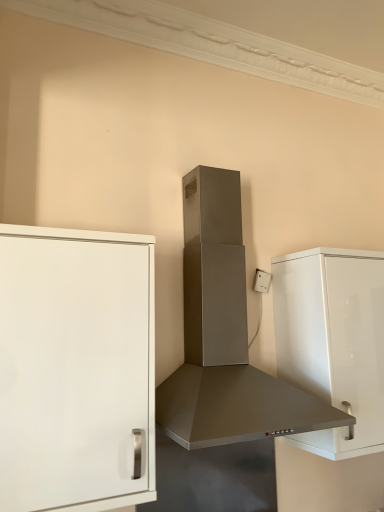
Measure the distance between satin silver range hood at center and camera.

satin silver range hood at center and camera are 1.16 meters apart.

Locate an element on the screen. This screenshot has height=512, width=384. white plastic electric outlet at upper right is located at coordinates (262, 281).

Find the location of a particular element. satin silver range hood at center is located at coordinates (224, 335).

Is satin silver range hood at center wider than white glossy cabinet at right, the 2th cabinetry when ordered from front to back?

Correct, the width of satin silver range hood at center exceeds that of white glossy cabinet at right, the 2th cabinetry when ordered from front to back.

Is point (206, 338) closer or farther from the camera than point (362, 402)?

Point (206, 338) is positioned farther from the camera compared to point (362, 402).

Is satin silver range hood at center at the left side of white glossy cabinet at right, the 1th cabinetry from the right?

Yes, satin silver range hood at center is to the left of white glossy cabinet at right, the 1th cabinetry from the right.

From the image's perspective, who appears lower, white glossy cabinet at right, which ranks as the 1th cabinetry in back-to-front order, or white matte cabinet at left, which is counted as the 2th cabinetry, starting from the right?

white glossy cabinet at right, which ranks as the 1th cabinetry in back-to-front order, is shown below in the image.

From a real-world perspective, is white glossy cabinet at right, the 1th cabinetry from the right, on white matte cabinet at left, which is counted as the second cabinetry, starting from the back?

Yes, from a real-world perspective, white glossy cabinet at right, the 1th cabinetry from the right, is above white matte cabinet at left, which is counted as the second cabinetry, starting from the back.

The height and width of the screenshot is (512, 384). I want to click on cabinetry that appears in front of the white glossy cabinet at right, the second cabinetry in the left-to-right sequence, so click(76, 369).

From the image's perspective, count 1st cabinetrys downward from the white plastic electric outlet at upper right and point to it. Please provide its 2D coordinates.

[(76, 369)]

Does white plastic electric outlet at upper right have a greater width compared to white matte cabinet at left, marked as the 1th cabinetry in a front-to-back arrangement?

No, white plastic electric outlet at upper right is not wider than white matte cabinet at left, marked as the 1th cabinetry in a front-to-back arrangement.

Does point (254, 290) lie behind point (110, 462)?

Yes, it is behind point (110, 462).

How different are the orientations of white matte cabinet at left, which is counted as the second cabinetry, starting from the back, and white plastic electric outlet at upper right in degrees?

4.91 degrees separate the facing orientations of white matte cabinet at left, which is counted as the second cabinetry, starting from the back, and white plastic electric outlet at upper right.

Is white matte cabinet at left, which is the 1th cabinetry from left to right, facing away from white plastic electric outlet at upper right?

No, white matte cabinet at left, which is the 1th cabinetry from left to right, is not facing away from white plastic electric outlet at upper right.

Considering the positions of points (44, 310) and (269, 286), is point (44, 310) farther from camera compared to point (269, 286)?

No.

Consider the image. From the image's perspective, is white matte cabinet at left, which is counted as the second cabinetry, starting from the back, located above or below white plastic electric outlet at upper right?

Based on their image positions, white matte cabinet at left, which is counted as the second cabinetry, starting from the back, is located beneath white plastic electric outlet at upper right.

Between point (257, 396) and point (98, 373), which one is positioned in front?

The point (98, 373) is closer.

From the image's perspective, is satin silver range hood at center located beneath white matte cabinet at left, marked as the 1th cabinetry in a front-to-back arrangement?

No.

Locate an element on the screen. The height and width of the screenshot is (512, 384). home appliance lying behind the white matte cabinet at left, which is the 1th cabinetry from left to right is located at coordinates (224, 335).

Does satin silver range hood at center appear on the left side of white matte cabinet at left, which is the 1th cabinetry from left to right?

In fact, satin silver range hood at center is to the right of white matte cabinet at left, which is the 1th cabinetry from left to right.

Can white glossy cabinet at right, the second cabinetry in the left-to-right sequence, be found inside white matte cabinet at left, which is counted as the second cabinetry, starting from the back?

No, white glossy cabinet at right, the second cabinetry in the left-to-right sequence, is not inside white matte cabinet at left, which is counted as the second cabinetry, starting from the back.

Can you confirm if white matte cabinet at left, marked as the 1th cabinetry in a front-to-back arrangement, is taller than white glossy cabinet at right, the 2th cabinetry when ordered from front to back?

Yes.

Between white matte cabinet at left, which is counted as the 2th cabinetry, starting from the right, and white glossy cabinet at right, the 2th cabinetry when ordered from front to back, which one has larger size?

With larger size is white glossy cabinet at right, the 2th cabinetry when ordered from front to back.

Visually, is white matte cabinet at left, which is the 1th cabinetry from left to right, positioned to the left or to the right of white glossy cabinet at right, which ranks as the 1th cabinetry in back-to-front order?

Clearly, white matte cabinet at left, which is the 1th cabinetry from left to right, is on the left of white glossy cabinet at right, which ranks as the 1th cabinetry in back-to-front order, in the image.

Locate an element on the screen. This screenshot has width=384, height=512. electric outlet lying on the right of satin silver range hood at center is located at coordinates (262, 281).

Who is taller, satin silver range hood at center or white plastic electric outlet at upper right?

Standing taller between the two is satin silver range hood at center.

Does point (252, 429) lie in front of point (268, 283)?

Yes, point (252, 429) is in front of point (268, 283).

From the picture: Is white plastic electric outlet at upper right completely or partially inside satin silver range hood at center?

Indeed, white plastic electric outlet at upper right is located within satin silver range hood at center.

I want to click on the 2nd cabinetry below the satin silver range hood at center (from the image's perspective), so click(333, 341).

Locate an element on the screen. cabinetry on the right side of white matte cabinet at left, which is counted as the second cabinetry, starting from the back is located at coordinates (333, 341).

Considering their positions, is white glossy cabinet at right, the 1th cabinetry from the right, positioned closer to satin silver range hood at center than white plastic electric outlet at upper right?

white glossy cabinet at right, the 1th cabinetry from the right, lies closer to satin silver range hood at center than the other object.

Looking at the image, which one is located further to white plastic electric outlet at upper right, white glossy cabinet at right, the 2th cabinetry when ordered from front to back, or white matte cabinet at left, which is counted as the second cabinetry, starting from the back?

Among the two, white matte cabinet at left, which is counted as the second cabinetry, starting from the back, is located further to white plastic electric outlet at upper right.

Based on their spatial positions, is white glossy cabinet at right, the second cabinetry in the left-to-right sequence, or white plastic electric outlet at upper right further from white matte cabinet at left, which is counted as the 2th cabinetry, starting from the right?

Based on the image, white plastic electric outlet at upper right appears to be further to white matte cabinet at left, which is counted as the 2th cabinetry, starting from the right.

Looking at the image, which one is located closer to white glossy cabinet at right, the second cabinetry in the left-to-right sequence, satin silver range hood at center or white plastic electric outlet at upper right?

satin silver range hood at center is closer to white glossy cabinet at right, the second cabinetry in the left-to-right sequence.

Looking at the image, which one is located further to satin silver range hood at center, white matte cabinet at left, which is the 1th cabinetry from left to right, or white glossy cabinet at right, which ranks as the 1th cabinetry in back-to-front order?

The object further to satin silver range hood at center is white matte cabinet at left, which is the 1th cabinetry from left to right.

Considering their positions, is satin silver range hood at center positioned closer to white plastic electric outlet at upper right than white matte cabinet at left, which is counted as the second cabinetry, starting from the back?

Answer: The object closer to white plastic electric outlet at upper right is satin silver range hood at center.

When comparing their distances from satin silver range hood at center, does white glossy cabinet at right, which ranks as the 1th cabinetry in back-to-front order, or white matte cabinet at left, marked as the 1th cabinetry in a front-to-back arrangement, seem closer?

Among the two, white glossy cabinet at right, which ranks as the 1th cabinetry in back-to-front order, is located nearer to satin silver range hood at center.

From the image, which object appears to be nearer to satin silver range hood at center, white plastic electric outlet at upper right or white glossy cabinet at right, which ranks as the 1th cabinetry in back-to-front order?

white glossy cabinet at right, which ranks as the 1th cabinetry in back-to-front order, lies closer to satin silver range hood at center than the other object.

The image size is (384, 512). Identify the location of home appliance between white matte cabinet at left, which is the 1th cabinetry from left to right, and white plastic electric outlet at upper right, along the z-axis. (224, 335).

Identify the location of cabinetry located between satin silver range hood at center and white plastic electric outlet at upper right in the depth direction. (333, 341).

Where is `electric outlet between white matte cabinet at left, marked as the 1th cabinetry in a front-to-back arrangement, and white glossy cabinet at right, which ranks as the 1th cabinetry in back-to-front order, from left to right`? The height and width of the screenshot is (512, 384). electric outlet between white matte cabinet at left, marked as the 1th cabinetry in a front-to-back arrangement, and white glossy cabinet at right, which ranks as the 1th cabinetry in back-to-front order, from left to right is located at coordinates (262, 281).

Where is `home appliance situated between white matte cabinet at left, which is counted as the 2th cabinetry, starting from the right, and white glossy cabinet at right, which ranks as the 1th cabinetry in back-to-front order, from left to right`? home appliance situated between white matte cabinet at left, which is counted as the 2th cabinetry, starting from the right, and white glossy cabinet at right, which ranks as the 1th cabinetry in back-to-front order, from left to right is located at coordinates (224, 335).